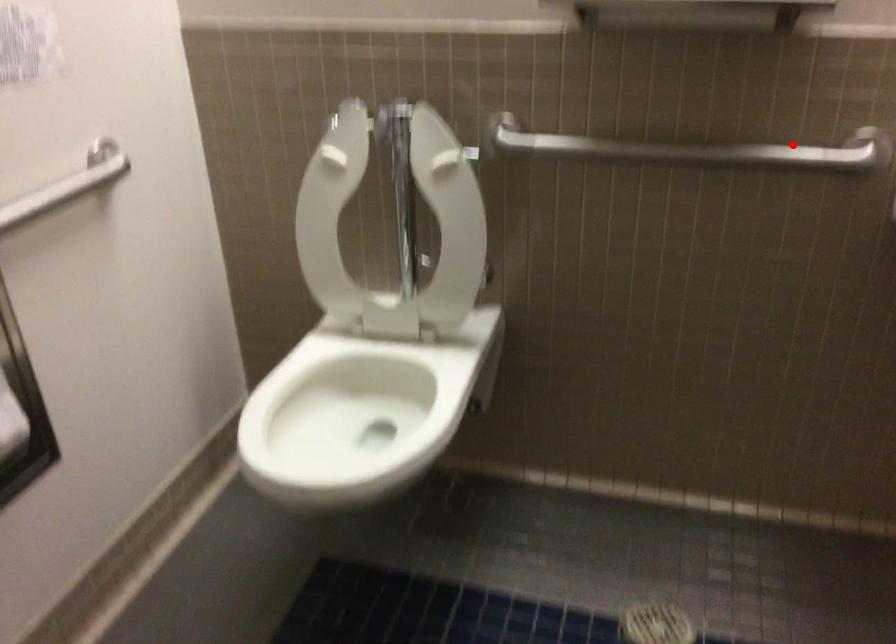
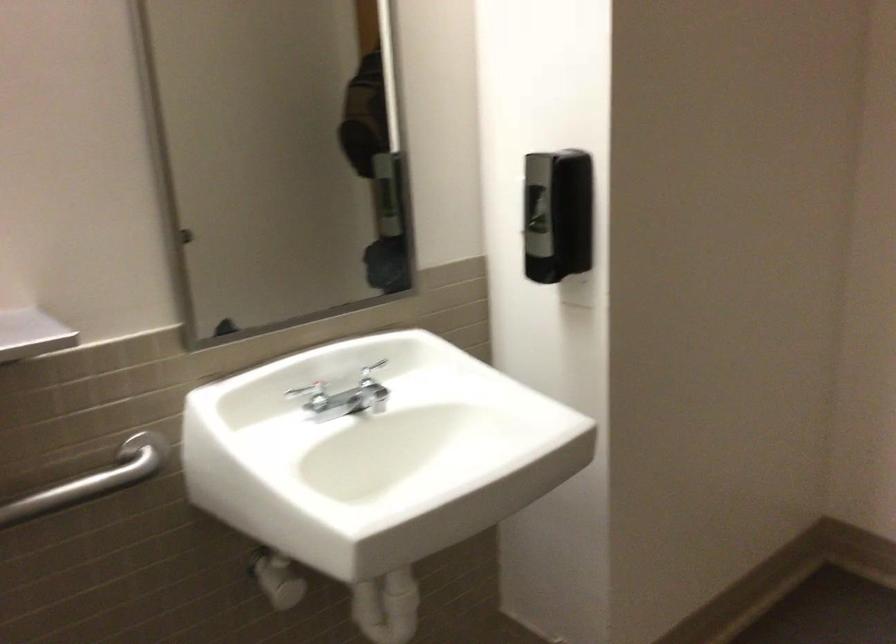
Where in the second image is the point corresponding to the highlighted location from the first image?

(92, 480)